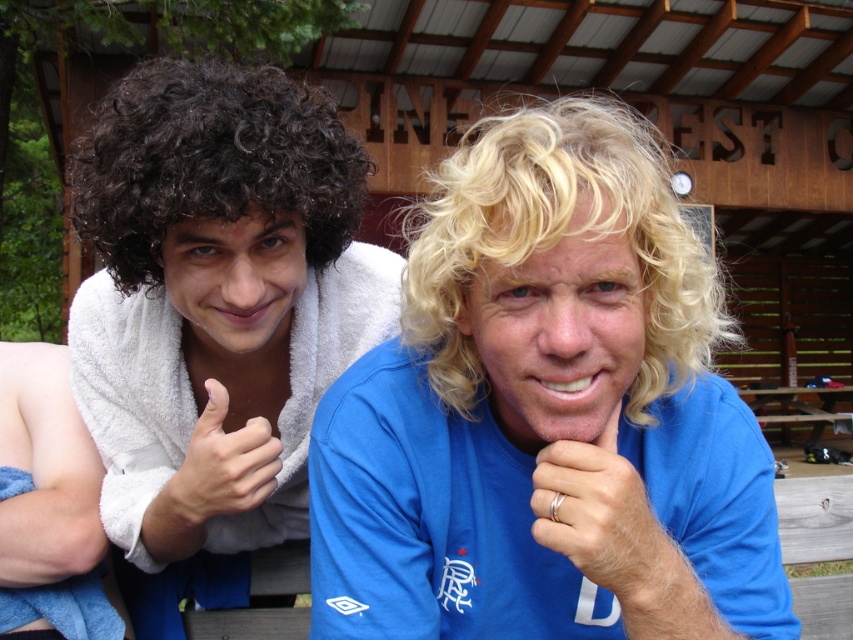
You are a photographer taking a picture of the two people in the scene. You notice the blue cotton shirt at center and the blonde curly hair at center. Which object should you adjust to ensure both are visible in the frame?

The blue cotton shirt at center is much taller than the blonde curly hair at center, so you should lower the camera angle to include the entire blue cotton shirt at center while still capturing the blonde curly hair at center in the frame.

You are standing in front of the wooden structure and want to determine the relative positions of two points marked in the image. Which point is closer to you, point (254, 202) or point (621, 557)?

Point (254, 202) is closer to you because it is further to the viewer than point (621, 557).

From the picture: You are standing in the image and want to locate the blue cotton shirt at center. Where exactly should you look?

The blue cotton shirt at center is located at point [546,413].